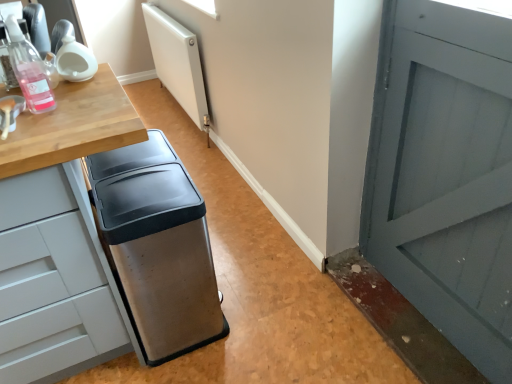
Question: Is stainless steel trash can at center completely or partially outside of translucent plastic bottle at left?

Choices:
 (A) no
 (B) yes

Answer: (B)

Question: Is stainless steel trash can at center shorter than translucent plastic bottle at left?

Choices:
 (A) no
 (B) yes

Answer: (A)

Question: Does stainless steel trash can at center lie behind translucent plastic bottle at left?

Choices:
 (A) no
 (B) yes

Answer: (B)

Question: From a real-world perspective, does stainless steel trash can at center sit lower than translucent plastic bottle at left?

Choices:
 (A) yes
 (B) no

Answer: (A)

Question: From the image's perspective, is stainless steel trash can at center below translucent plastic bottle at left?

Choices:
 (A) no
 (B) yes

Answer: (B)

Question: From the image's perspective, is translucent plastic bottle at left above or below white matte radiator at upper center?

Choices:
 (A) above
 (B) below

Answer: (B)

Question: From a real-world perspective, is translucent plastic bottle at left physically located above or below white matte radiator at upper center?

Choices:
 (A) below
 (B) above

Answer: (B)

Question: Is translucent plastic bottle at left inside the boundaries of white matte radiator at upper center, or outside?

Choices:
 (A) outside
 (B) inside

Answer: (A)

Question: Is translucent plastic bottle at left taller or shorter than white matte radiator at upper center?

Choices:
 (A) tall
 (B) short

Answer: (B)

Question: In terms of height, does white matte radiator at upper center look taller or shorter compared to translucent plastic bottle at left?

Choices:
 (A) tall
 (B) short

Answer: (A)

Question: Visually, is white matte radiator at upper center positioned to the left or to the right of translucent plastic bottle at left?

Choices:
 (A) right
 (B) left

Answer: (A)

Question: In the image, is white matte radiator at upper center positioned in front of or behind translucent plastic bottle at left?

Choices:
 (A) front
 (B) behind

Answer: (B)

Question: Based on their sizes in the image, would you say white matte radiator at upper center is bigger or smaller than translucent plastic bottle at left?

Choices:
 (A) small
 (B) big

Answer: (B)

Question: Is stainless steel trash can at center in front of or behind white matte radiator at upper center in the image?

Choices:
 (A) front
 (B) behind

Answer: (A)

Question: In terms of width, does stainless steel trash can at center look wider or thinner when compared to white matte radiator at upper center?

Choices:
 (A) thin
 (B) wide

Answer: (B)